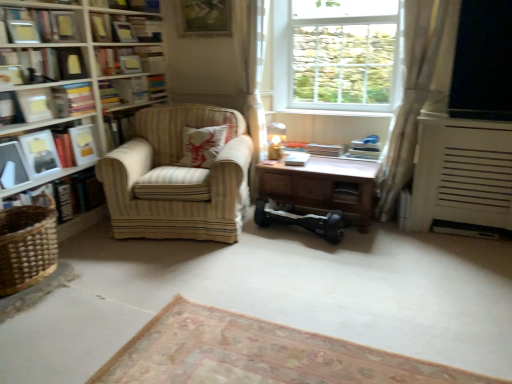
Question: From the image's perspective, is hardcover book at center, the 1th book positioned from the right, under matte white book at upper left, which is the first book in left-to-right order?

Choices:
 (A) no
 (B) yes

Answer: (B)

Question: From a real-world perspective, is hardcover book at center, the 1th book positioned from the right, positioned under matte white book at upper left, which is the first book in left-to-right order, based on gravity?

Choices:
 (A) no
 (B) yes

Answer: (B)

Question: From the image's perspective, is hardcover book at center, the 1th book positioned from the right, on matte white book at upper left, the 7th book from the right?

Choices:
 (A) no
 (B) yes

Answer: (A)

Question: Can you confirm if hardcover book at center, the 7th book from the left, is wider than matte white book at upper left, which is the first book in left-to-right order?

Choices:
 (A) no
 (B) yes

Answer: (B)

Question: Can you confirm if hardcover book at center, the 1th book positioned from the right, is smaller than matte white book at upper left, which is the first book in left-to-right order?

Choices:
 (A) yes
 (B) no

Answer: (A)

Question: Is hardcover book at center, the 7th book from the left, at the left side of matte white book at upper left, the 7th book from the right?

Choices:
 (A) no
 (B) yes

Answer: (A)

Question: Is hardcover book at left, which is the fourth book from right to left, directly adjacent to matte white paperback book at left, which ranks as the 2th paperback book in right-to-left order?

Choices:
 (A) yes
 (B) no

Answer: (A)

Question: Can you confirm if hardcover book at left, which is the fourth book from right to left, is positioned to the right of matte white paperback book at left, which ranks as the 2th paperback book in right-to-left order?

Choices:
 (A) no
 (B) yes

Answer: (A)

Question: Is the position of hardcover book at left, arranged as the 4th book when viewed from the left, more distant than that of matte white paperback book at left, which ranks as the second paperback book in left-to-right order?

Choices:
 (A) yes
 (B) no

Answer: (B)

Question: From the image's perspective, does hardcover book at left, which is the fourth book from right to left, appear higher than matte white paperback book at left, which ranks as the 2th paperback book in right-to-left order?

Choices:
 (A) yes
 (B) no

Answer: (B)

Question: Is hardcover book at left, which is the fourth book from right to left, at the left side of matte white paperback book at left, which ranks as the 2th paperback book in right-to-left order?

Choices:
 (A) yes
 (B) no

Answer: (A)

Question: Is the depth of hardcover book at left, arranged as the 4th book when viewed from the left, less than that of matte white paperback book at left, which ranks as the second paperback book in left-to-right order?

Choices:
 (A) yes
 (B) no

Answer: (A)

Question: Does hardcover book at center, marked as the first paperback book in a right-to-left arrangement, lie in front of transparent glass window screen at upper right?

Choices:
 (A) yes
 (B) no

Answer: (B)